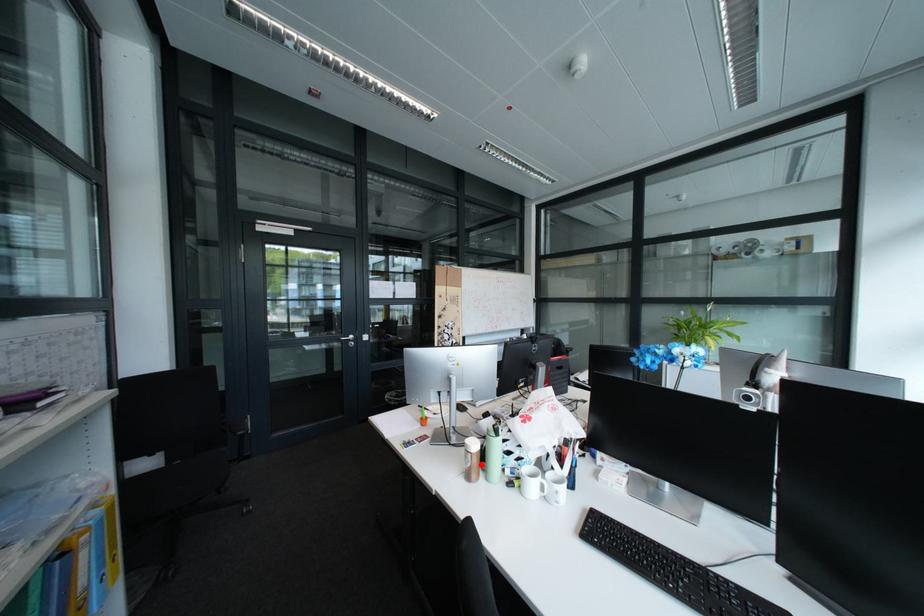
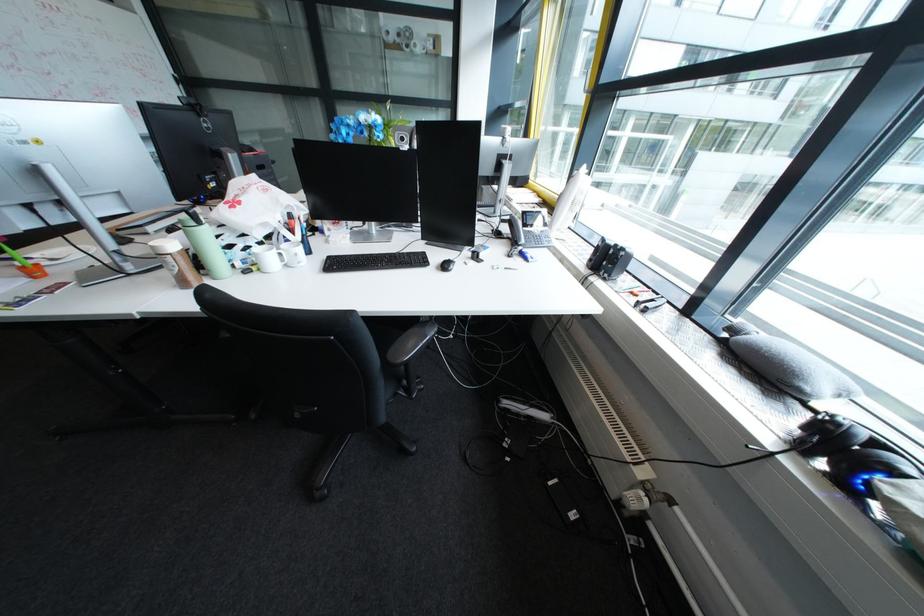
Where in the second image is the point corresponding to the highlighted location from the first image?

(187, 270)